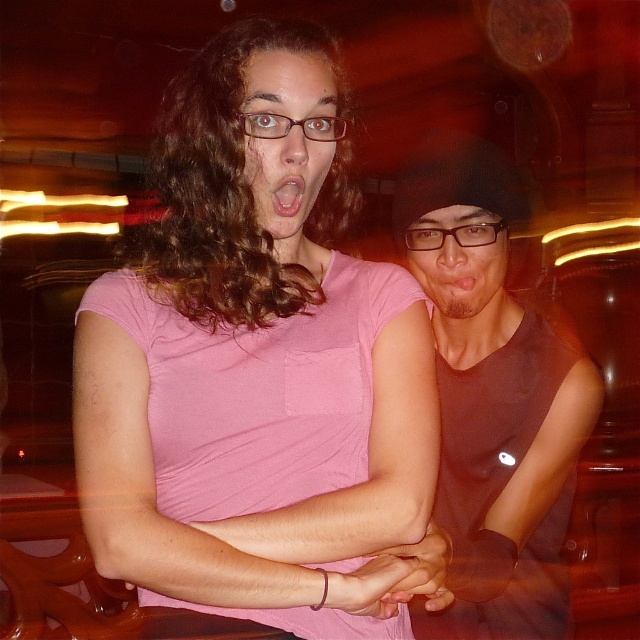
You are a photographer adjusting the focus of your camera. The two subjects are positioned such that their features are slightly out of focus. To ensure both the matte pink shirt at center and the matte black glasses at center are in sharp focus, what adjustment should you make?

Since the matte pink shirt at center is 34.23 centimeters away from the matte black glasses at center, you should increase the depth of field to ensure both are in focus.

You are taking a photo of two friends in a bar. You notice the pink matte shirt at center and the matte black tank top at center. Which one is positioned closer to the camera?

The pink matte shirt at center is closer to the viewer than the matte black tank top at center, so the pink matte shirt at center is positioned closer to the camera.